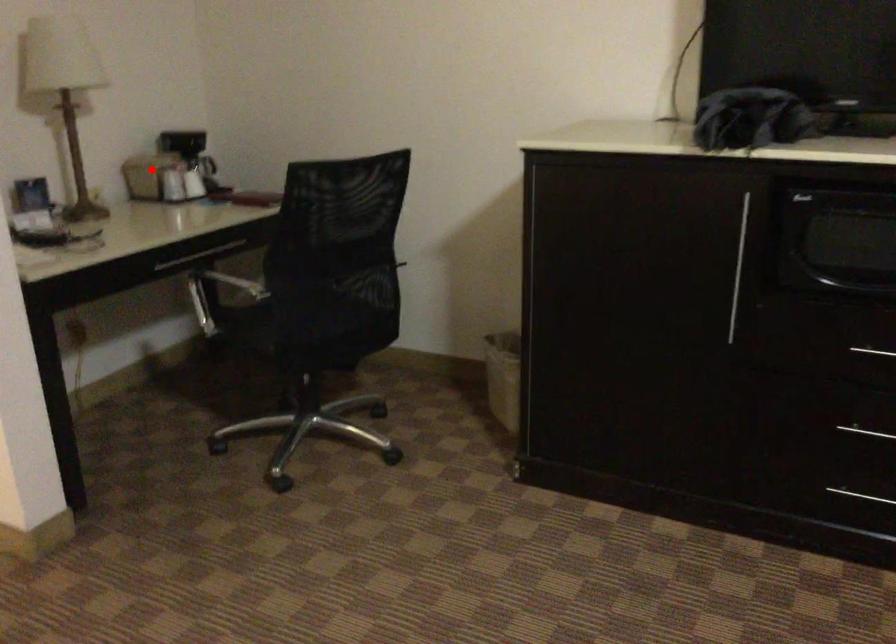
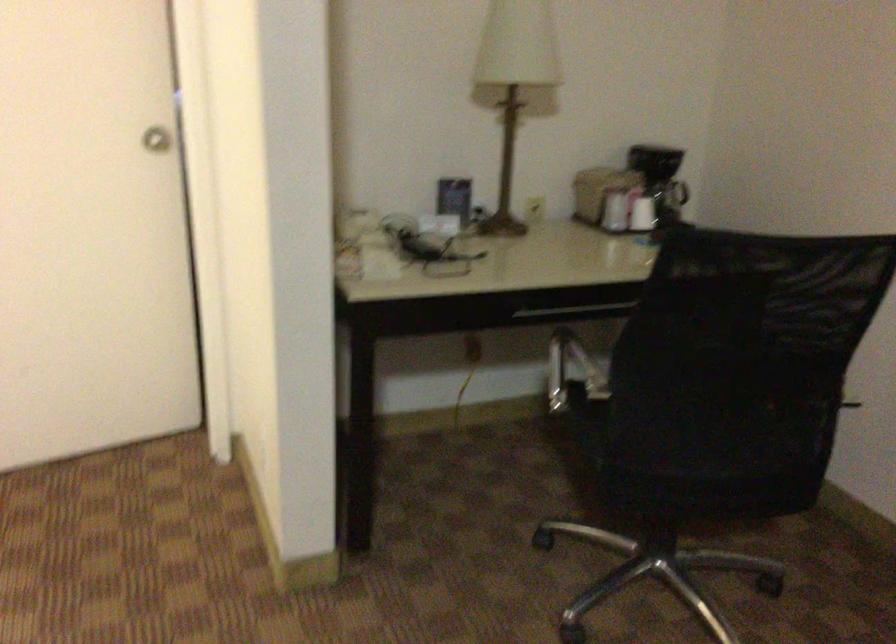
Question: A red point is marked in image1. In image2, is the corresponding 3D point closer to the camera or farther? Reply with the corresponding letter.

Choices:
 (A) The corresponding 3D point is closer.
 (B) The corresponding 3D point is farther.

Answer: (A)